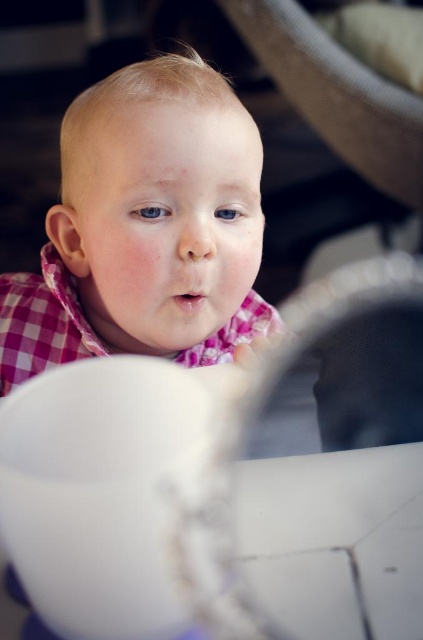
You are a photographer adjusting the focus on your camera. You want to ensure both the pink checkered bib at center and the white matte bowl at lower center are in focus. Given the current depth of field, which is 6 inches, can you capture both objects clearly without refocusing?

The distance between the pink checkered bib at center and the white matte bowl at lower center is 6.54 inches. Since the depth of field is only 6 inches, the photographer would need to refocus to ensure both are in focus.

You are a photographer adjusting the focus on a camera to capture the baby in the image. The pink checkered bib at center and the white matte bowl at lower center are both in view. Which object should you focus on to ensure the baby is sharp, considering the bowl is behind the bib?

The white matte bowl at lower center is behind the pink checkered bib at center, so focusing on the pink checkered bib at center will keep the baby sharp while the bowl may appear slightly out of focus due to the shallow depth of field.

You are a photographer adjusting the focus of your camera to capture the baby in the image. The pink checkered bib at center is your main subject. Where should you position the focus point to ensure the bib is sharply in focus?

The 2D location of the pink checkered bib at center is at point (145, 227), so you should position the focus point at coordinates (145, 227) to ensure the bib is sharply in focus.